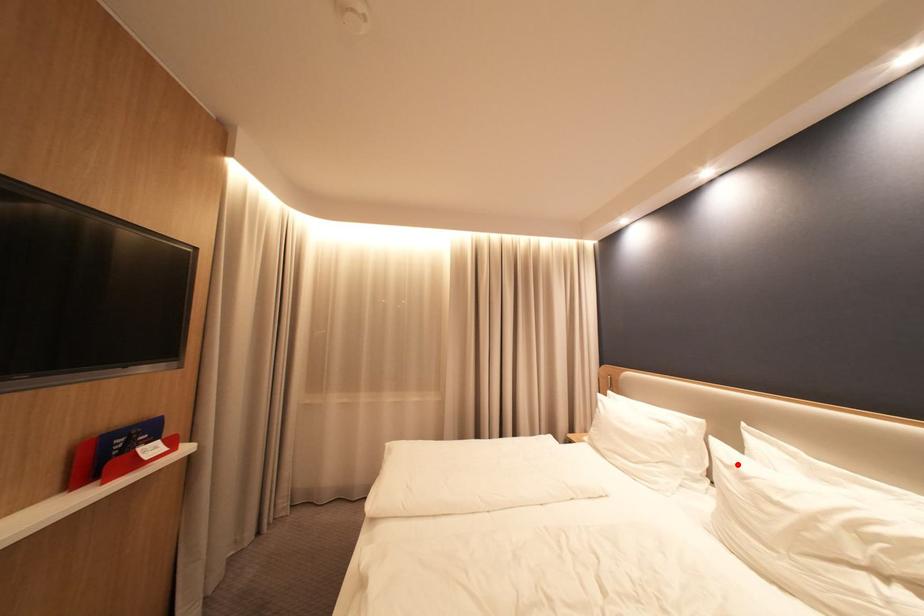
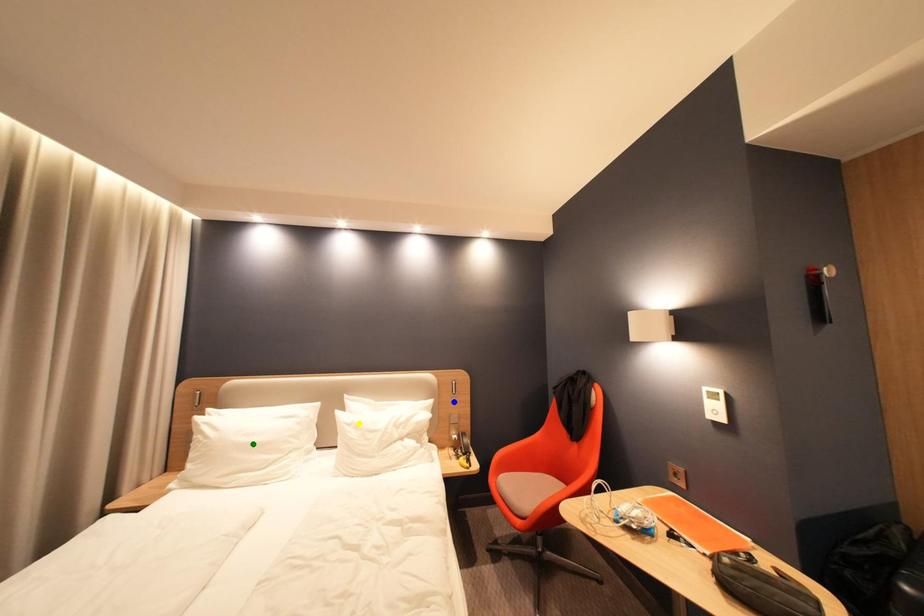
Question: I am providing you with two images of the same scene from different viewpoints. A red point is marked on the first image. You are given multiple points on the second image. Which point in image 2 represents the same 3d spot as the red point in image 1?

Choices:
 (A) green point
 (B) yellow point
 (C) blue point

Answer: (B)